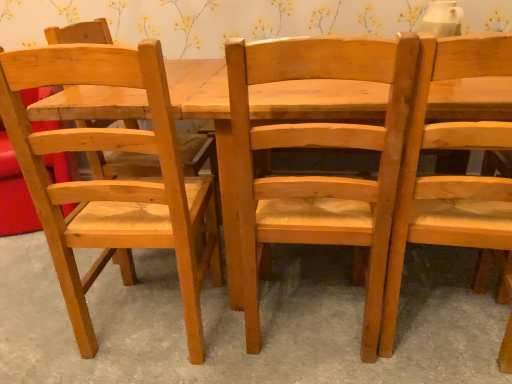
Question: From a real-world perspective, is natural wood chair at center, which is the second chair from left to right, physically below natural wood chair at center?

Choices:
 (A) yes
 (B) no

Answer: (B)

Question: Is natural wood chair at center, which is the second chair from left to right, at the left side of natural wood chair at center?

Choices:
 (A) yes
 (B) no

Answer: (B)

Question: Can you confirm if natural wood chair at center, which is the second chair from left to right, is thinner than natural wood chair at center?

Choices:
 (A) no
 (B) yes

Answer: (B)

Question: Can natural wood chair at center be found inside natural wood chair at center, marked as the second chair in a right-to-left arrangement?

Choices:
 (A) yes
 (B) no

Answer: (B)

Question: Is natural wood chair at center, which is the second chair from left to right, completely or partially outside of natural wood chair at center?

Choices:
 (A) no
 (B) yes

Answer: (B)

Question: Is natural wood chair at left, the 3th chair viewed from the right, wider or thinner than natural wood chair at center, which is the second chair from left to right?

Choices:
 (A) wide
 (B) thin

Answer: (B)

Question: Does point (23, 66) appear closer or farther from the camera than point (411, 43)?

Choices:
 (A) farther
 (B) closer

Answer: (A)

Question: From a real-world perspective, is natural wood chair at left, the 3th chair viewed from the right, physically located above or below natural wood chair at center, which is the second chair from left to right?

Choices:
 (A) above
 (B) below

Answer: (A)

Question: From the image's perspective, is natural wood chair at left, the 3th chair viewed from the right, located above or below natural wood chair at center, which is the second chair from left to right?

Choices:
 (A) below
 (B) above

Answer: (A)

Question: From the image's perspective, is natural wood chair at center, which is the second chair from left to right, positioned above or below natural wood chair at center?

Choices:
 (A) above
 (B) below

Answer: (A)

Question: From their relative heights in the image, would you say natural wood chair at center, which is the second chair from left to right, is taller or shorter than natural wood chair at center?

Choices:
 (A) short
 (B) tall

Answer: (B)

Question: Considering the relative positions of natural wood chair at center, marked as the second chair in a right-to-left arrangement, and natural wood chair at center in the image provided, is natural wood chair at center, marked as the second chair in a right-to-left arrangement, to the left or to the right of natural wood chair at center?

Choices:
 (A) left
 (B) right

Answer: (B)

Question: Considering the positions of natural wood chair at center, which is the second chair from left to right, and natural wood chair at center in the image, is natural wood chair at center, which is the second chair from left to right, bigger or smaller than natural wood chair at center?

Choices:
 (A) big
 (B) small

Answer: (A)

Question: From a real-world perspective, is natural wood chair at center, which is the second chair from left to right, positioned above or below natural wood chair at right, the 3th chair viewed from the left?

Choices:
 (A) above
 (B) below

Answer: (B)

Question: Is point (289, 185) closer or farther from the camera than point (423, 180)?

Choices:
 (A) farther
 (B) closer

Answer: (A)